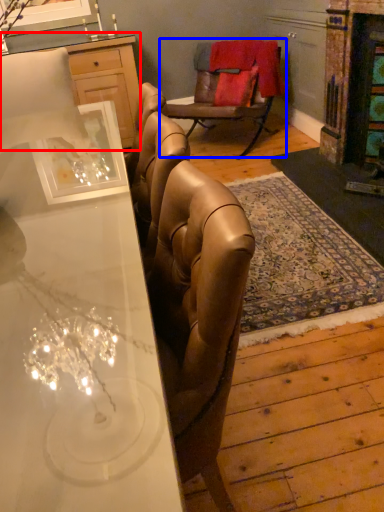
Question: Which point is closer to the camera, cabinetry (highlighted by a red box) or chair (highlighted by a blue box)?

Choices:
 (A) cabinetry
 (B) chair

Answer: (B)